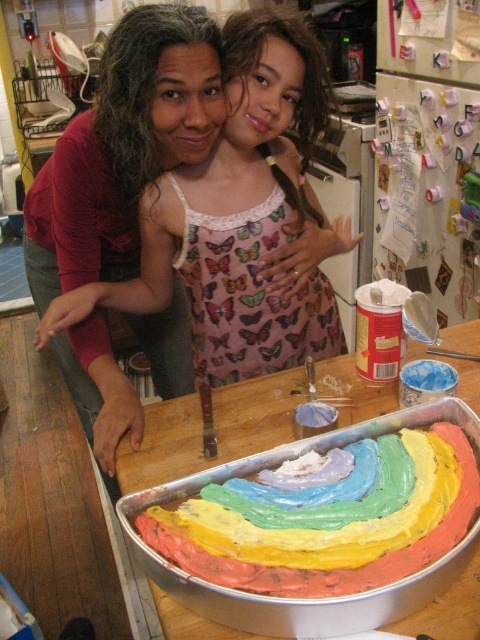
Can you confirm if butterfly-patterned fabric at center is positioned to the left of rainbow-colored frosting at center?

Indeed, butterfly-patterned fabric at center is positioned on the left side of rainbow-colored frosting at center.

Looking at this image, does butterfly-patterned fabric at center have a smaller size compared to rainbow-colored frosting at center?

Incorrect, butterfly-patterned fabric at center is not smaller in size than rainbow-colored frosting at center.

Is point (96, 115) closer to viewer compared to point (462, 497)?

No, (96, 115) is further to viewer.

Where is `butterfly-patterned fabric at center`? The image size is (480, 640). butterfly-patterned fabric at center is located at coordinates (135, 179).

Is butterfly-patterned fabric at center taller than white creamy frosting at center?

Indeed, butterfly-patterned fabric at center has a greater height compared to white creamy frosting at center.

Is butterfly-patterned fabric at center to the left of white creamy frosting at center from the viewer's perspective?

Correct, you'll find butterfly-patterned fabric at center to the left of white creamy frosting at center.

Where is `butterfly-patterned fabric at center`? The image size is (480, 640). butterfly-patterned fabric at center is located at coordinates (135, 179).

Between rainbow-colored frosting at center and white creamy frosting at center, which one has more height?

With more height is rainbow-colored frosting at center.

Is rainbow-colored frosting at center above white creamy frosting at center?

No.

This screenshot has height=640, width=480. Describe the element at coordinates (320, 566) in the screenshot. I see `rainbow-colored frosting at center` at that location.

Image resolution: width=480 pixels, height=640 pixels. What are the coordinates of `rainbow-colored frosting at center` in the screenshot? It's located at (320, 566).